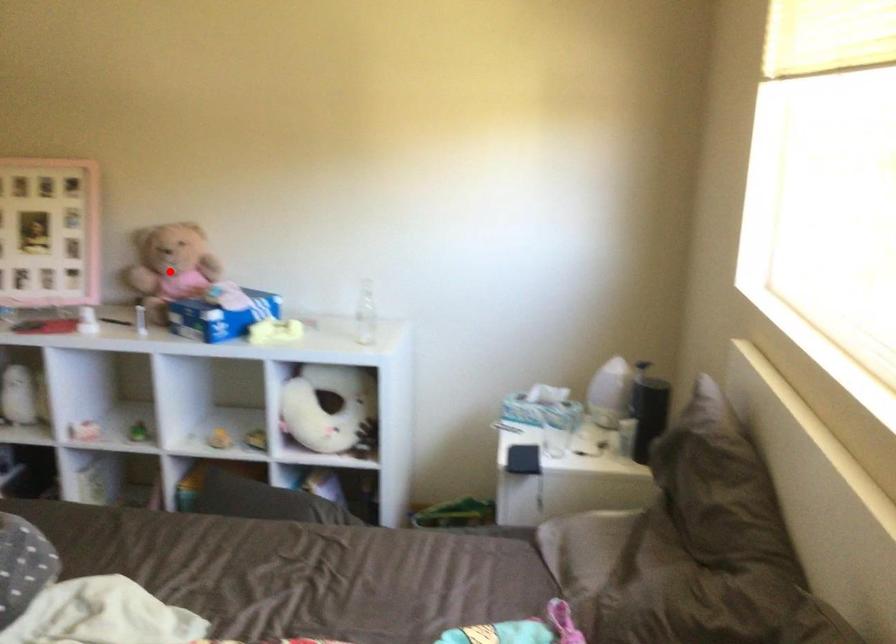
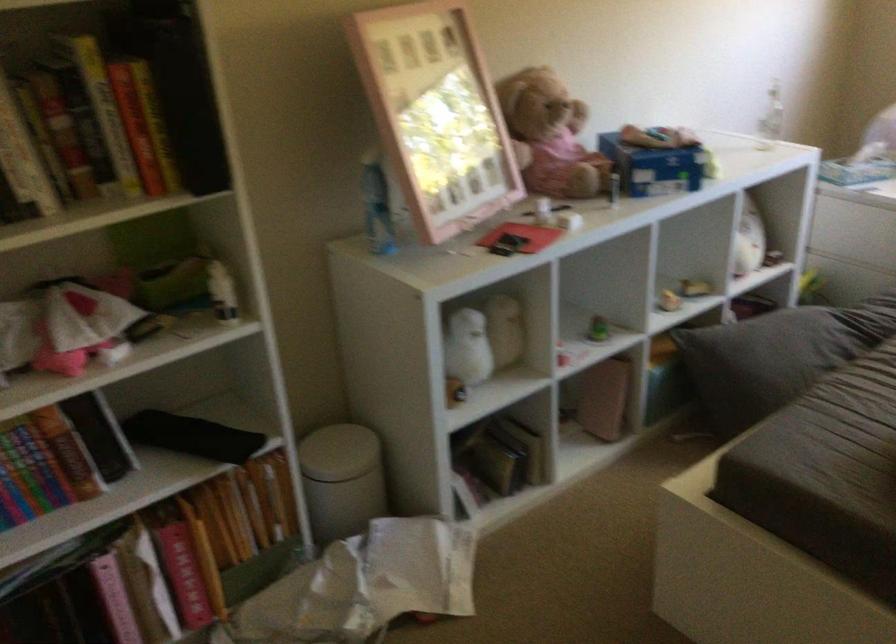
Locate, in the second image, the point that corresponds to the highlighted location in the first image.

(549, 136)